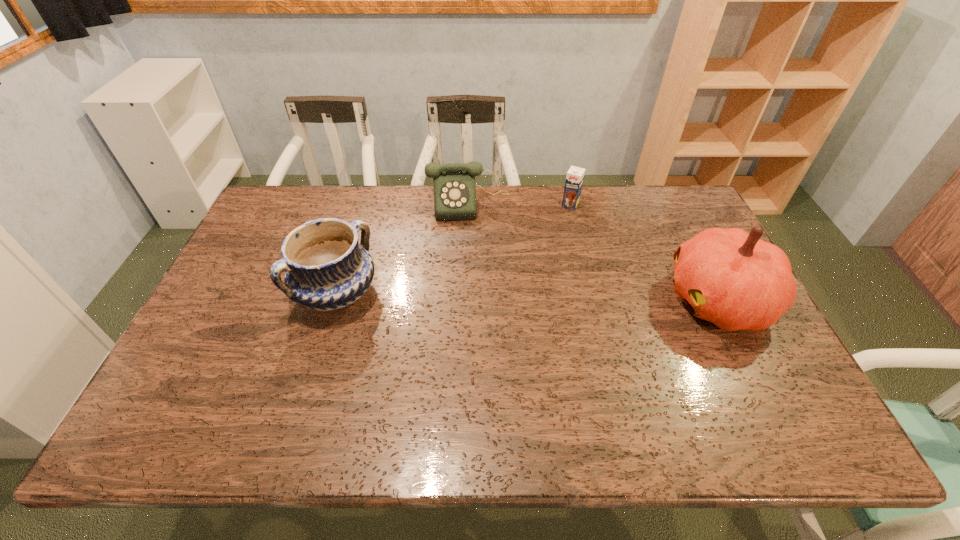
At what (x,y) coordinates should I click in order to perform the action: click on vacant position located 0.070m on the dial of the telephone. Please return your answer as a coordinate pair (x, y). Looking at the image, I should click on (472, 236).

This screenshot has width=960, height=540. I want to click on free space located on the dial of the telephone, so click(471, 232).

Where is `vacant region located 0.300m on the dial of the telephone`? vacant region located 0.300m on the dial of the telephone is located at coordinates (476, 289).

Find the location of a particular element. The width and height of the screenshot is (960, 540). vacant area situated on the front label of the second object from right to left is located at coordinates (533, 269).

This screenshot has width=960, height=540. I want to click on free space located 0.360m on the front label of the second object from right to left, so click(x=527, y=278).

Locate an element on the screen. The width and height of the screenshot is (960, 540). free region located on the front label of the second object from right to left is located at coordinates (547, 245).

The height and width of the screenshot is (540, 960). Identify the location of telephone present at the far edge. (454, 183).

Image resolution: width=960 pixels, height=540 pixels. Find the location of `chocolate milk at the far edge`. chocolate milk at the far edge is located at coordinates pyautogui.click(x=574, y=180).

Identify the location of object that is at the right edge. (729, 277).

Locate an element on the screen. vacant space at the far edge of the desktop is located at coordinates (538, 203).